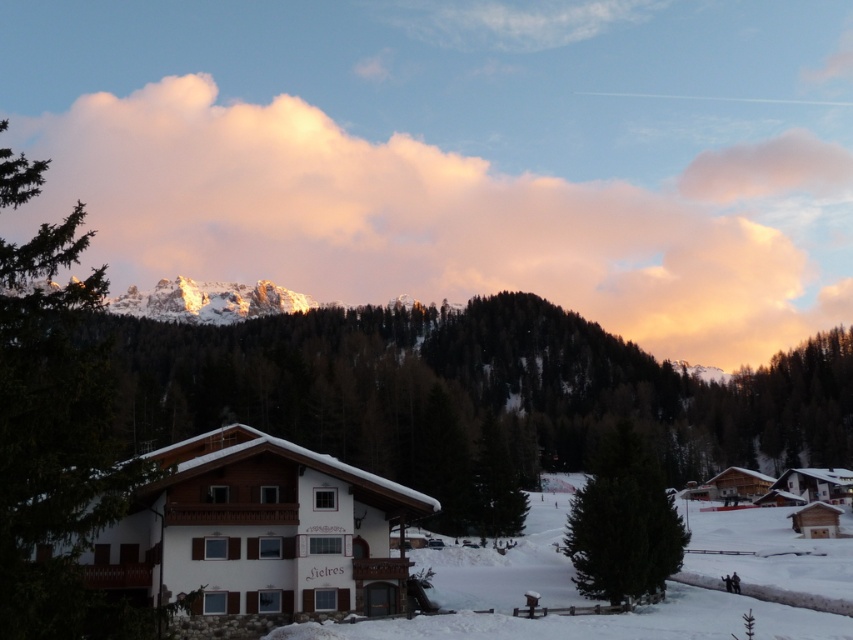
Which is behind, point (206, 467) or point (560, 513)?

The point (560, 513) is more distant.

Is white wooden house at center positioned before white snow ski slope at lower center?

Yes, white wooden house at center is closer to the viewer.

Which is in front, point (351, 566) or point (715, 532)?

Point (351, 566)

The height and width of the screenshot is (640, 853). I want to click on white wooden house at center, so click(x=256, y=536).

How distant is pink fluffy cloud at upper center from snowy rock formation at upper center?

pink fluffy cloud at upper center and snowy rock formation at upper center are 246.70 meters apart from each other.

Can you confirm if pink fluffy cloud at upper center is positioned to the right of snowy rock formation at upper center?

Correct, you'll find pink fluffy cloud at upper center to the right of snowy rock formation at upper center.

Locate an element on the screen. This screenshot has height=640, width=853. pink fluffy cloud at upper center is located at coordinates (766, 168).

Who is shorter, white wooden house at center or snowy rock formation at upper center?

Standing shorter between the two is white wooden house at center.

Who is more distant from viewer, (173, 497) or (268, 284)?

Positioned behind is point (268, 284).

Locate an element on the screen. Image resolution: width=853 pixels, height=640 pixels. white wooden house at center is located at coordinates (256, 536).